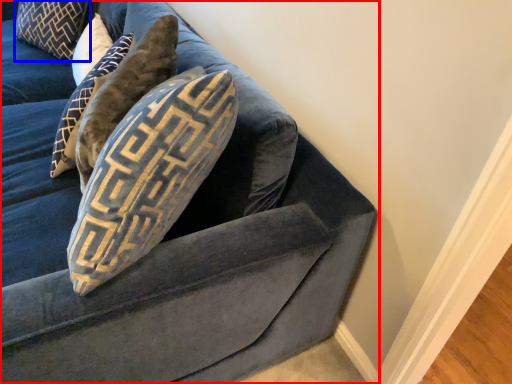
Question: Which of the following is the closest to the observer, studio couch (highlighted by a red box) or pillow (highlighted by a blue box)?

Choices:
 (A) studio couch
 (B) pillow

Answer: (A)